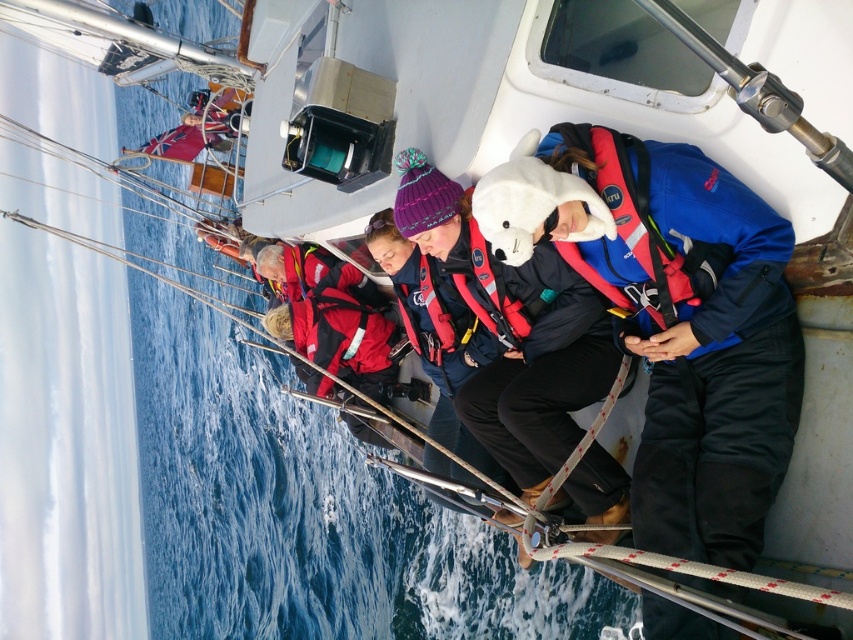
Question: Which point is closer to the camera?

Choices:
 (A) red matte life jacket at center
 (B) matte blue jacket at center

Answer: (B)

Question: Observing the image, what is the correct spatial positioning of blue fabric life jacket at upper right in reference to red matte life jacket at center?

Choices:
 (A) below
 (B) above

Answer: (B)

Question: Which point appears farthest from the camera in this image?

Choices:
 (A) (653, 246)
 (B) (715, 385)
 (C) (358, 296)

Answer: (C)

Question: Does matte blue jacket at center have a smaller size compared to red matte life jacket at center?

Choices:
 (A) yes
 (B) no

Answer: (A)

Question: Is matte blue jacket at center wider than blue fabric life jacket at upper right?

Choices:
 (A) no
 (B) yes

Answer: (B)

Question: Considering the real-world distances, which object is farthest from the blue fabric life jacket at upper right?

Choices:
 (A) red matte life jacket at center
 (B) blue fleece jacket at center
 (C) matte blue jacket at center

Answer: (A)